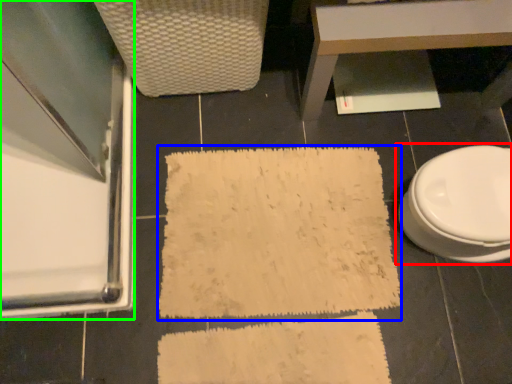
Question: Which object is positioned farthest from toilet (highlighted by a red box)? Select from bath mat (highlighted by a blue box) and screen door (highlighted by a green box).

Choices:
 (A) bath mat
 (B) screen door

Answer: (B)